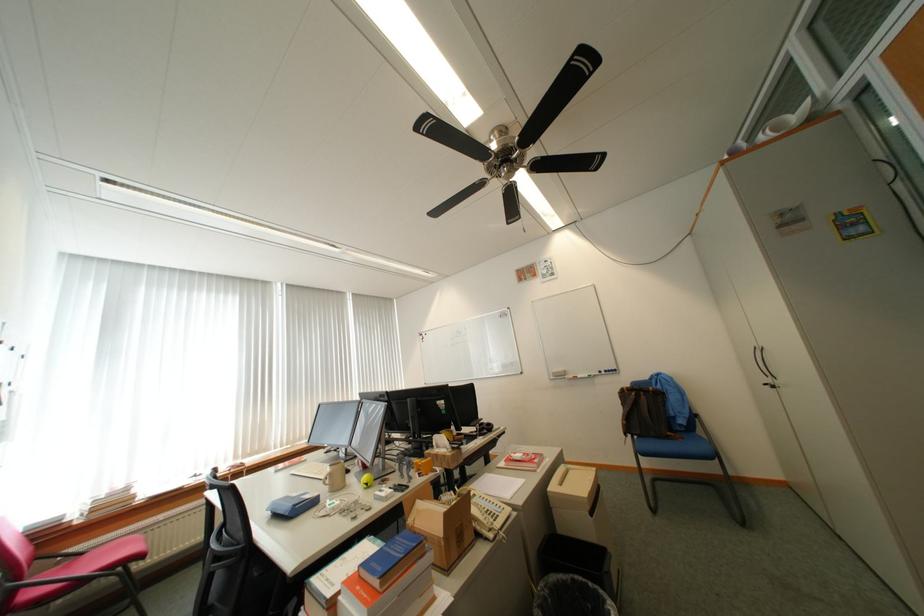
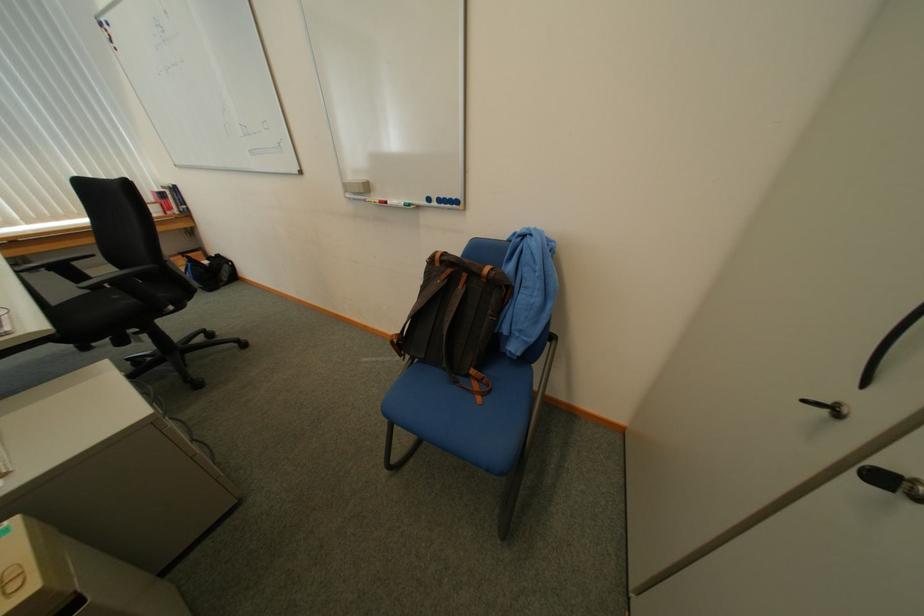
Find the pixel in the second image that matches the point at 652,399 in the first image.

(469, 290)